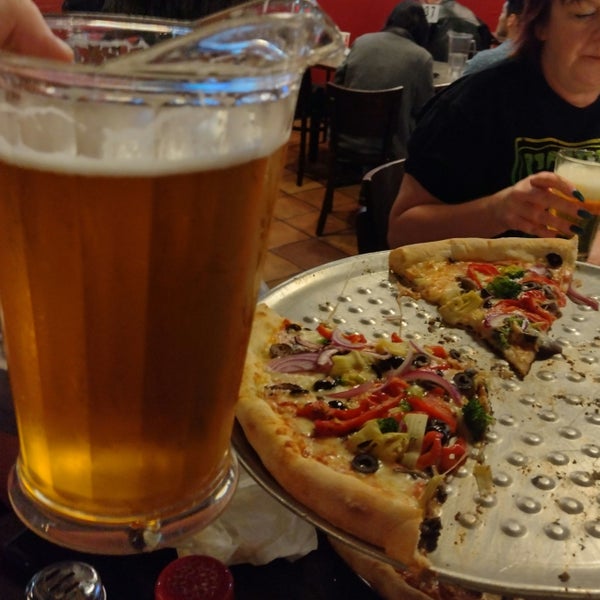
This screenshot has height=600, width=600. What are the coordinates of `walls` in the screenshot? It's located at (351, 7), (51, 6).